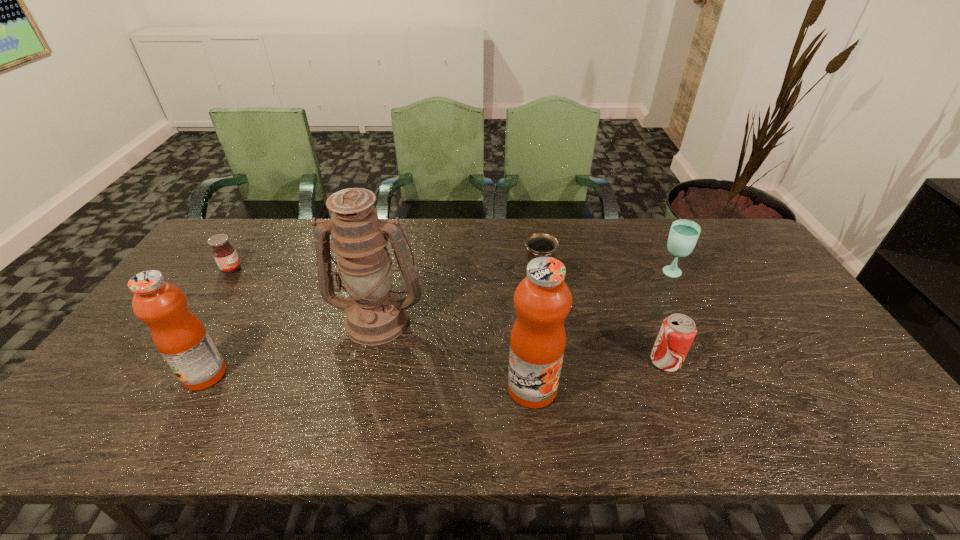
Identify the location of vacant space located on the front label of the sixth object from right to left. The height and width of the screenshot is (540, 960). (144, 375).

Find the location of a particular element. Image resolution: width=960 pixels, height=540 pixels. free spot located 0.060m on the front label of the sixth object from right to left is located at coordinates (160, 375).

This screenshot has width=960, height=540. I want to click on blank area located on the front label of the sixth object from right to left, so click(x=140, y=375).

Find the location of a particular element. The image size is (960, 540). vacant space located 0.080m on the left of the fifth object from right to left is located at coordinates (x=301, y=319).

The image size is (960, 540). Identify the location of vacant area located on the left of the rightmost object. (567, 273).

Locate an element on the screen. vacant space situated 0.130m on the back of the soda can is located at coordinates (647, 314).

You are a GUI agent. You are given a task and a screenshot of the screen. Output one action in this format:
    pyautogui.click(x=<x>, y=<y>)
    Task: Click on the vacant space located 0.390m on the label side of the leftmost object
    
    Given the screenshot: What is the action you would take?
    pyautogui.click(x=365, y=269)

Locate an element on the screen. free space located on the left of the chalice is located at coordinates (404, 289).

The width and height of the screenshot is (960, 540). I want to click on object present at the left edge, so click(225, 255).

The width and height of the screenshot is (960, 540). I want to click on vacant space at the far edge, so click(x=444, y=229).